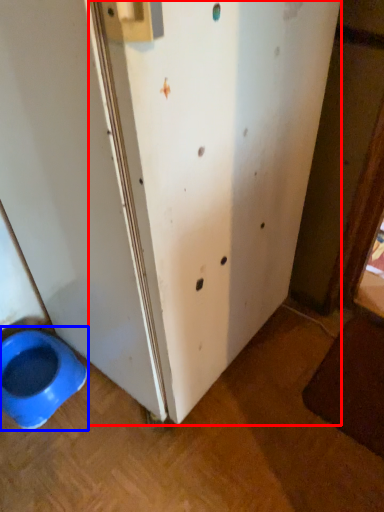
Question: Which point is closer to the camera, screen door (highlighted by a red box) or toilet (highlighted by a blue box)?

Choices:
 (A) screen door
 (B) toilet

Answer: (A)